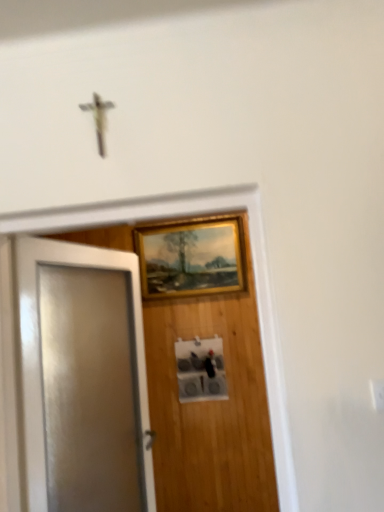
Question: From a real-world perspective, relative to gold/gilded picture frame at upper center, is white glossy door at left vertically above or below?

Choices:
 (A) above
 (B) below

Answer: (B)

Question: Looking at their shapes, would you say white glossy door at left is wider or thinner than gold/gilded picture frame at upper center?

Choices:
 (A) thin
 (B) wide

Answer: (B)

Question: From the image's perspective, is white glossy door at left above or below gold/gilded picture frame at upper center?

Choices:
 (A) above
 (B) below

Answer: (B)

Question: In terms of height, does gold/gilded picture frame at upper center look taller or shorter compared to white glossy door at left?

Choices:
 (A) tall
 (B) short

Answer: (B)

Question: From the image's perspective, is gold/gilded picture frame at upper center located above or below white glossy door at left?

Choices:
 (A) above
 (B) below

Answer: (A)

Question: In the image, is gold/gilded picture frame at upper center positioned in front of or behind white glossy door at left?

Choices:
 (A) front
 (B) behind

Answer: (B)

Question: In terms of width, does gold/gilded picture frame at upper center look wider or thinner when compared to white glossy door at left?

Choices:
 (A) thin
 (B) wide

Answer: (A)